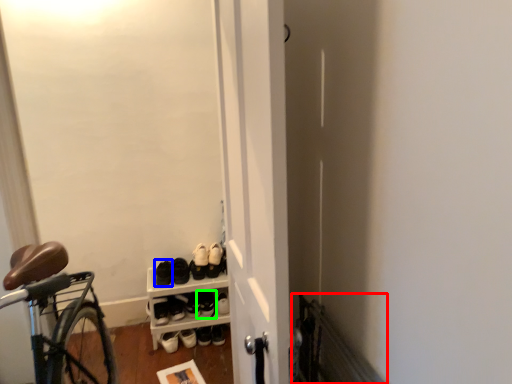
Question: Which is farther away from radiator (highlighted by a red box)? footwear (highlighted by a blue box) or footwear (highlighted by a green box)?

Choices:
 (A) footwear
 (B) footwear

Answer: (A)